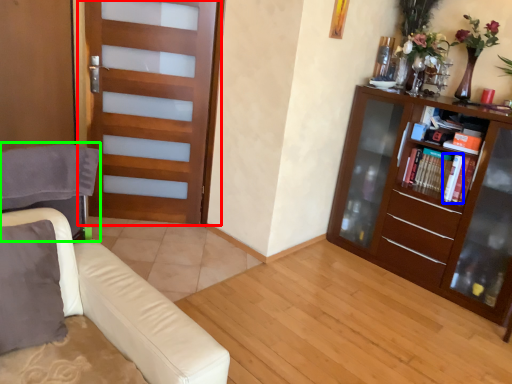
Question: Which is nearer to the door (highlighted by a red box)? book (highlighted by a blue box) or swivel chair (highlighted by a green box).

Choices:
 (A) book
 (B) swivel chair

Answer: (B)